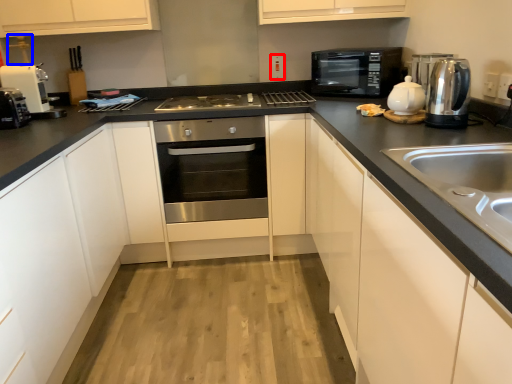
Question: Among these objects, which one is nearest to the camera, electric outlet (highlighted by a red box) or faucet (highlighted by a blue box)?

Choices:
 (A) electric outlet
 (B) faucet

Answer: (B)